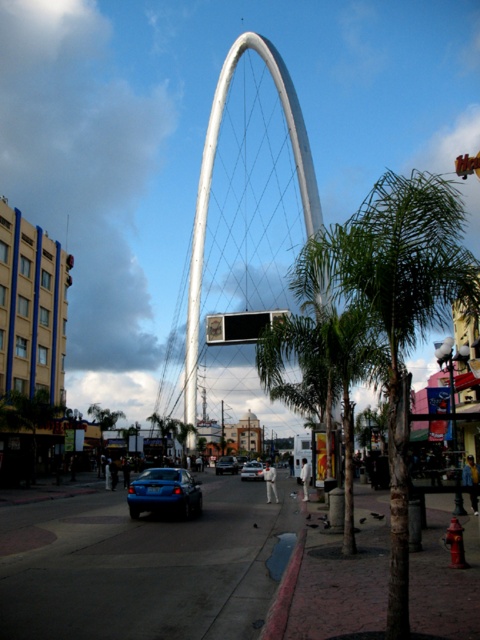
Based on the photo, between green leafy palm tree at center-right and blue glossy sedan at center, which one appears on the left side from the viewer's perspective?

blue glossy sedan at center is more to the left.

Can you confirm if green leafy palm tree at center-right is thinner than blue glossy sedan at center?

No, green leafy palm tree at center-right is not thinner than blue glossy sedan at center.

In the scene shown: Who is more distant from viewer, (406, 577) or (223, 470)?

Positioned behind is point (223, 470).

The image size is (480, 640). In order to click on green leafy palm tree at center-right in this screenshot , I will do [x=396, y=310].

Does green leafy palm tree at center have a greater height compared to blue metallic car at center?

Yes, green leafy palm tree at center is taller than blue metallic car at center.

Who is higher up, green leafy palm tree at center or blue metallic car at center?

green leafy palm tree at center

Describe the element at coordinates (324, 371) in the screenshot. I see `green leafy palm tree at center` at that location.

The height and width of the screenshot is (640, 480). What are the coordinates of `green leafy palm tree at center` in the screenshot? It's located at (324, 371).

Can you confirm if green leafy palm tree at center is thinner than white metallic arch at center?

Yes.

Is point (337, 364) positioned in front of point (317, 202)?

Yes, point (337, 364) is in front of point (317, 202).

Who is more distant from viewer, (337,380) or (197,320)?

Positioned behind is point (197,320).

The width and height of the screenshot is (480, 640). Find the location of `green leafy palm tree at center`. green leafy palm tree at center is located at coordinates (324, 371).